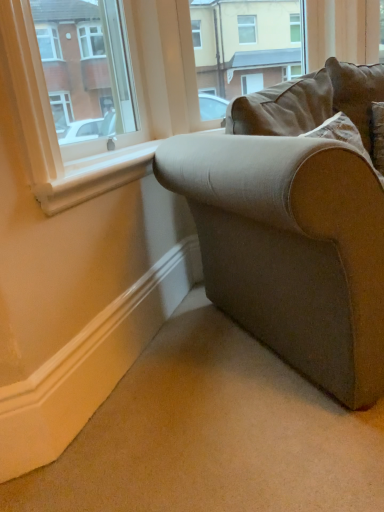
Question: Is matte white window at upper left not close to brown fabric couch at upper right?

Choices:
 (A) yes
 (B) no

Answer: (A)

Question: From the image's perspective, would you say matte white window at upper left is shown under brown fabric couch at upper right?

Choices:
 (A) no
 (B) yes

Answer: (B)

Question: Is the position of matte white window at upper left less distant than that of brown fabric couch at upper right?

Choices:
 (A) yes
 (B) no

Answer: (A)

Question: Is matte white window at upper left oriented towards brown fabric couch at upper right?

Choices:
 (A) no
 (B) yes

Answer: (A)

Question: Is matte white window at upper left positioned behind brown fabric couch at upper right?

Choices:
 (A) yes
 (B) no

Answer: (B)

Question: From a real-world perspective, relative to textured beige couch at lower right, is white painted wood at lower left vertically above or below?

Choices:
 (A) below
 (B) above

Answer: (B)

Question: Is white painted wood at lower left taller or shorter than textured beige couch at lower right?

Choices:
 (A) tall
 (B) short

Answer: (B)

Question: Does point (114, 163) appear closer or farther from the camera than point (276, 115)?

Choices:
 (A) farther
 (B) closer

Answer: (B)

Question: Considering their positions, is white painted wood at lower left located in front of or behind textured beige couch at lower right?

Choices:
 (A) front
 (B) behind

Answer: (B)

Question: From a real-world perspective, is brown fabric couch at upper right physically located above or below white painted wood at lower left?

Choices:
 (A) below
 (B) above

Answer: (B)

Question: Based on their positions, is brown fabric couch at upper right located to the left or right of white painted wood at lower left?

Choices:
 (A) left
 (B) right

Answer: (B)

Question: Considering the positions of point click(x=274, y=25) and point click(x=145, y=162), is point click(x=274, y=25) closer or farther from the camera than point click(x=145, y=162)?

Choices:
 (A) farther
 (B) closer

Answer: (A)

Question: Is brown fabric couch at upper right spatially inside white painted wood at lower left, or outside of it?

Choices:
 (A) inside
 (B) outside

Answer: (B)

Question: From the image's perspective, relative to brown fabric couch at upper right, is matte white window at upper left above or below?

Choices:
 (A) above
 (B) below

Answer: (B)

Question: Relative to brown fabric couch at upper right, is matte white window at upper left in front or behind?

Choices:
 (A) behind
 (B) front

Answer: (B)